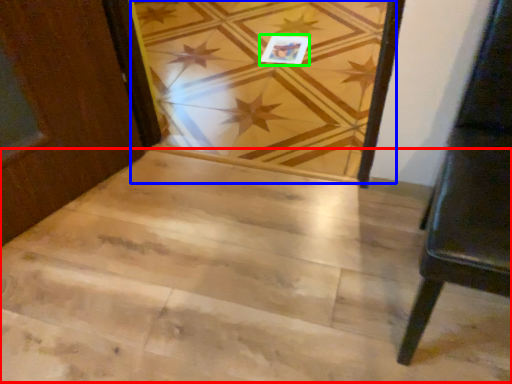
Question: Which is farther away from stairwell (highlighted by a red box)? plank (highlighted by a blue box) or postcard (highlighted by a green box)?

Choices:
 (A) plank
 (B) postcard

Answer: (B)